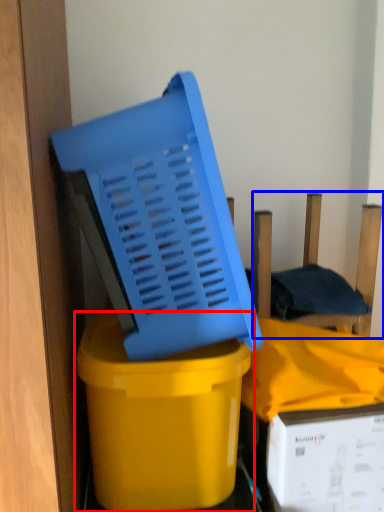
Question: Which object is closer to the camera taking this photo, waste container (highlighted by a red box) or chair (highlighted by a blue box)?

Choices:
 (A) waste container
 (B) chair

Answer: (A)